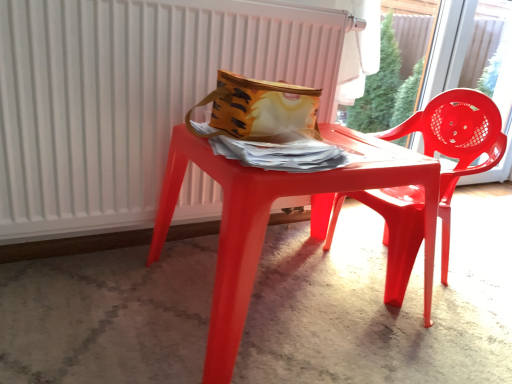
Question: From the image's perspective, is glossy plastic chair at right beneath transparent plastic chair at upper right?

Choices:
 (A) no
 (B) yes

Answer: (B)

Question: Considering the relative sizes of glossy plastic chair at right and transparent plastic chair at upper right in the image provided, is glossy plastic chair at right wider than transparent plastic chair at upper right?

Choices:
 (A) yes
 (B) no

Answer: (A)

Question: Would you say glossy plastic chair at right is outside transparent plastic chair at upper right?

Choices:
 (A) yes
 (B) no

Answer: (A)

Question: Considering the relative sizes of glossy plastic chair at right and transparent plastic chair at upper right in the image provided, is glossy plastic chair at right taller than transparent plastic chair at upper right?

Choices:
 (A) no
 (B) yes

Answer: (A)

Question: Is the position of glossy plastic chair at right less distant than that of transparent plastic chair at upper right?

Choices:
 (A) no
 (B) yes

Answer: (B)

Question: From a real-world perspective, is transparent plastic chair at upper right above or below glossy plastic chair at right?

Choices:
 (A) below
 (B) above

Answer: (B)

Question: Is transparent plastic chair at upper right bigger or smaller than glossy plastic chair at right?

Choices:
 (A) big
 (B) small

Answer: (B)

Question: Would you say transparent plastic chair at upper right is to the left or to the right of glossy plastic chair at right in the picture?

Choices:
 (A) left
 (B) right

Answer: (B)

Question: In the image, is transparent plastic chair at upper right positioned in front of or behind glossy plastic chair at right?

Choices:
 (A) front
 (B) behind

Answer: (B)

Question: From the image's perspective, is glossy plastic table at center above or below matte yellow fabric bag at center?

Choices:
 (A) below
 (B) above

Answer: (A)

Question: Looking at the image, does glossy plastic table at center seem bigger or smaller compared to matte yellow fabric bag at center?

Choices:
 (A) big
 (B) small

Answer: (A)

Question: Is glossy plastic table at center taller or shorter than matte yellow fabric bag at center?

Choices:
 (A) short
 (B) tall

Answer: (B)

Question: In the image, is glossy plastic table at center on the left side or the right side of matte yellow fabric bag at center?

Choices:
 (A) left
 (B) right

Answer: (B)

Question: Based on their positions, is white plastic radiator at upper center located to the left or right of glossy plastic table at center?

Choices:
 (A) right
 (B) left

Answer: (B)

Question: Is white plastic radiator at upper center taller or shorter than glossy plastic table at center?

Choices:
 (A) tall
 (B) short

Answer: (A)